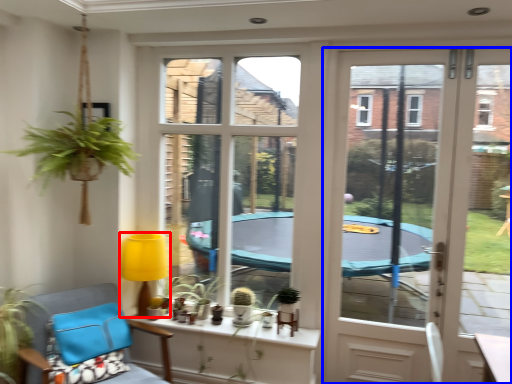
Question: Which of the following is the farthest to the observer, lamp (highlighted by a red box) or door (highlighted by a blue box)?

Choices:
 (A) lamp
 (B) door

Answer: (A)